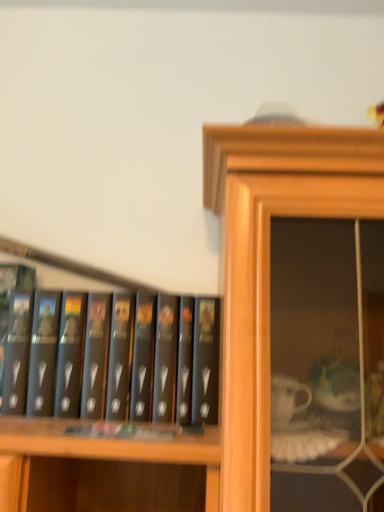
Image resolution: width=384 pixels, height=512 pixels. Describe the element at coordinates (109, 402) in the screenshot. I see `black matte bookshelf at center` at that location.

Where is `black matte bookshelf at center`? The image size is (384, 512). black matte bookshelf at center is located at coordinates (109, 402).

You are a GUI agent. You are given a task and a screenshot of the screen. Output one action in this format:
    pyautogui.click(x=<x>, y=<y>)
    Task: Click on the black matte bookshelf at center
    This screenshot has width=384, height=512.
    Given the screenshot: What is the action you would take?
    pyautogui.click(x=109, y=402)